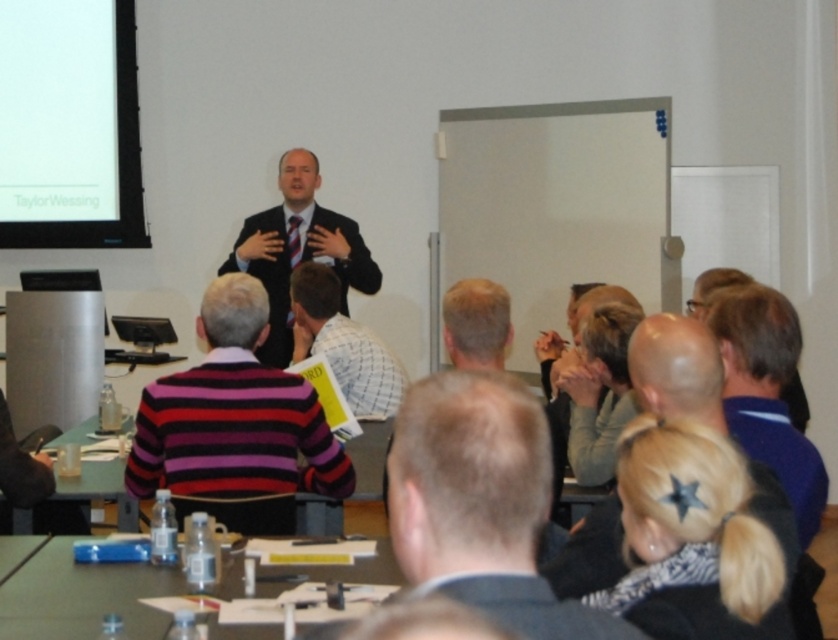
Question: From the image, what is the correct spatial relationship of blue shirt at lower right in relation to plaid shirt at center?

Choices:
 (A) right
 (B) left

Answer: (A)

Question: Considering the real-world distances, which object is closest to the striped sweater at center?

Choices:
 (A) clear plastic table at lower center
 (B) blonde hair at lower right
 (C) plaid shirt at center

Answer: (A)

Question: Which point is farther to the camera?

Choices:
 (A) (3, 579)
 (B) (733, 284)
 (C) (737, 400)

Answer: (B)

Question: Can you confirm if striped sweater at center is positioned above clear plastic table at lower center?

Choices:
 (A) no
 (B) yes

Answer: (B)

Question: Does clear plastic table at lower center have a larger size compared to plaid shirt at center?

Choices:
 (A) yes
 (B) no

Answer: (B)

Question: Estimate the real-world distances between objects in this image. Which object is closer to the light gray sweater at center?

Choices:
 (A) matte black laptop at left
 (B) blonde hair at lower right

Answer: (B)